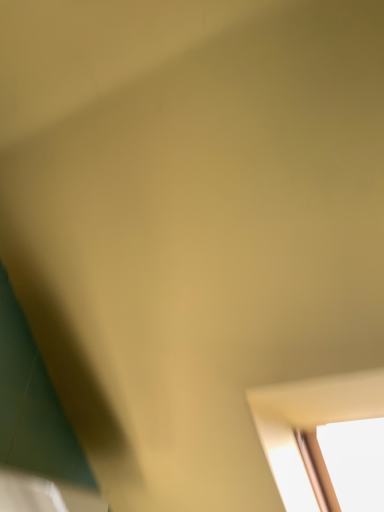
Locate an element on the screen. matte glass window at lower right is located at coordinates (310, 430).

Describe the element at coordinates (310, 430) in the screenshot. I see `matte glass window at lower right` at that location.

This screenshot has width=384, height=512. Identify the location of matte glass window at lower right. (310, 430).